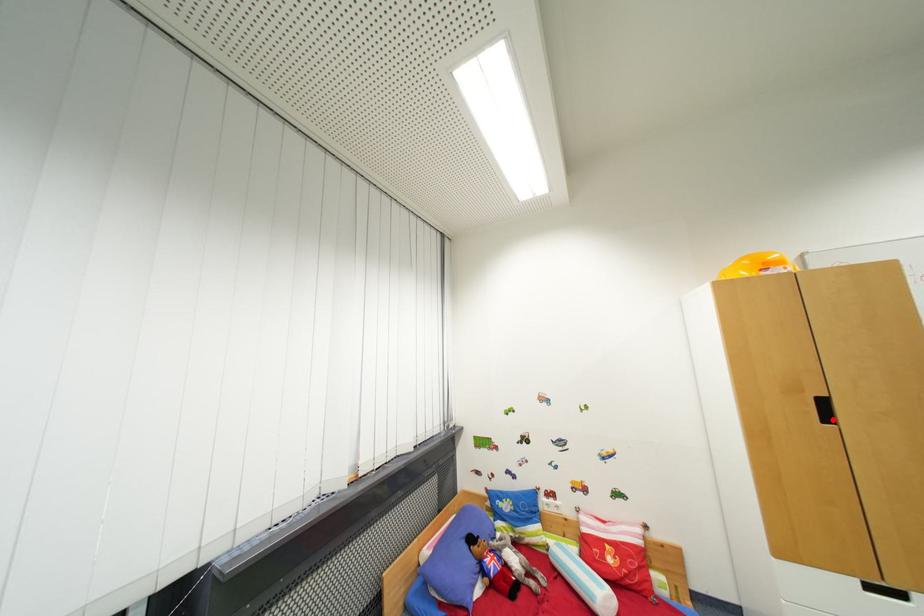
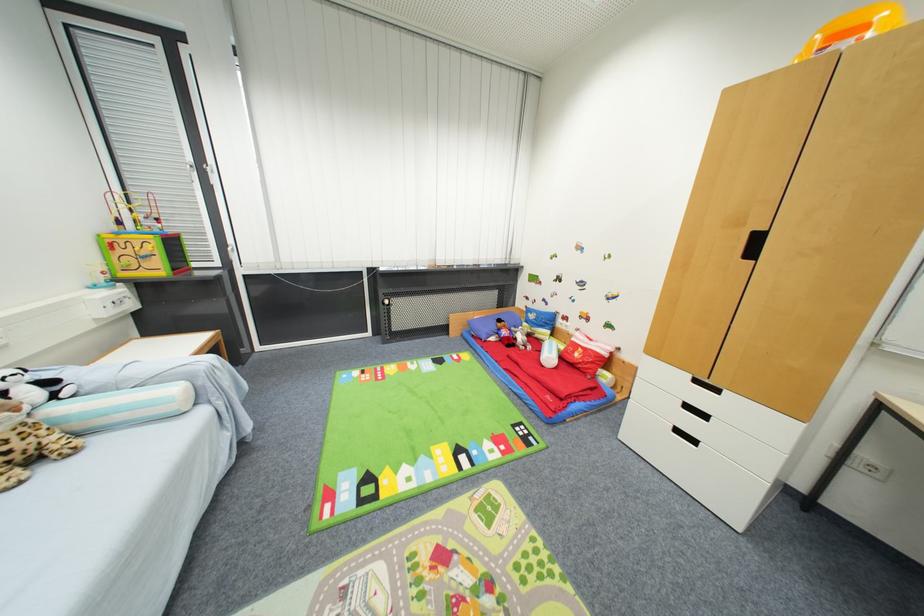
The point at the highlighted location is marked in the first image. Where is the corresponding point in the second image?

(757, 254)